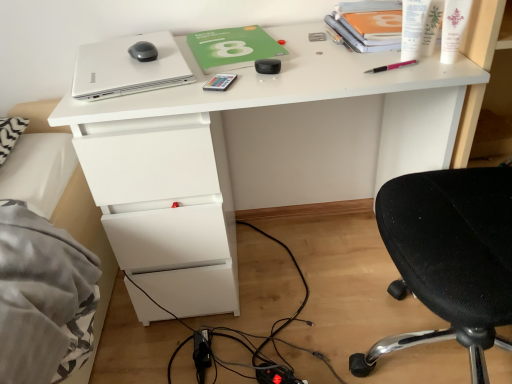
Identify the location of vacant space that is in between green matte notebook at center and pink plastic pen at upper right, placed as the 3th stationery when sorted from right to left. (321, 59).